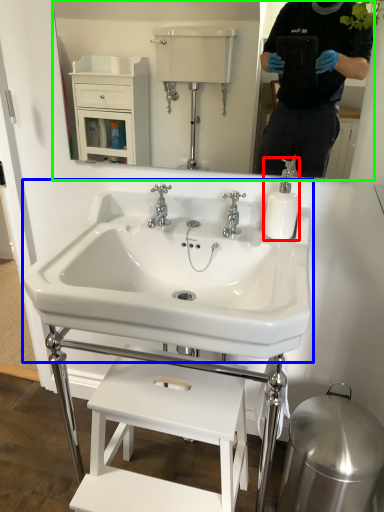
Question: Which object is positioned closest to soap dispenser (highlighted by a red box)? Select from sink (highlighted by a blue box) and mirror (highlighted by a green box).

Choices:
 (A) sink
 (B) mirror

Answer: (A)